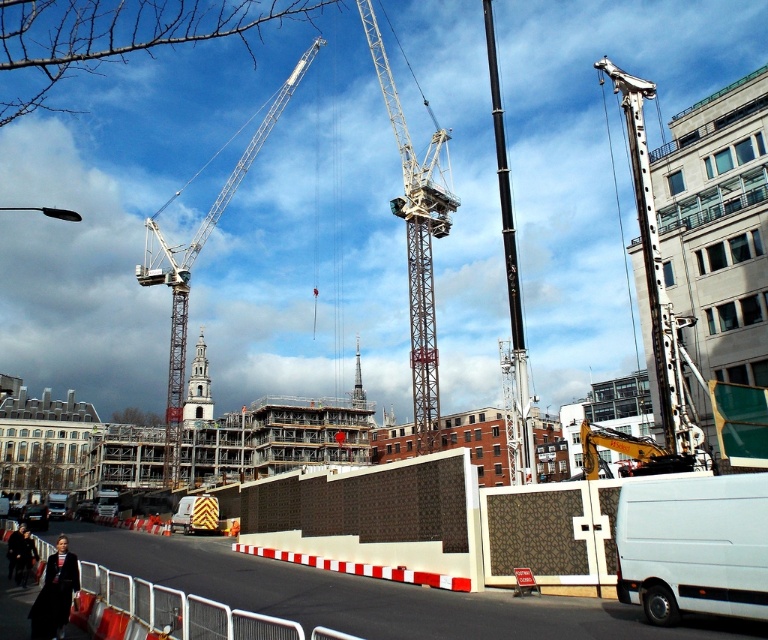
Question: Which of the following is the closest to the observer?

Choices:
 (A) (647, 544)
 (B) (637, 196)

Answer: (A)

Question: Can you confirm if metallic gray crane at right is positioned to the right of white metallic crane at upper left?

Choices:
 (A) yes
 (B) no

Answer: (A)

Question: Which point appears closest to the camera in this image?

Choices:
 (A) (439, 205)
 (B) (492, 116)
 (C) (293, 74)
 (D) (623, 77)

Answer: (D)

Question: Is the position of white matte van at lower right less distant than that of dark brown leather jacket at lower left?

Choices:
 (A) no
 (B) yes

Answer: (B)

Question: Which point is farther to the camera?

Choices:
 (A) metallic gray crane at center
 (B) white matte van at lower right

Answer: (A)

Question: Can you confirm if white matte van at lower right is positioned below metallic gray crane at center?

Choices:
 (A) yes
 (B) no

Answer: (A)